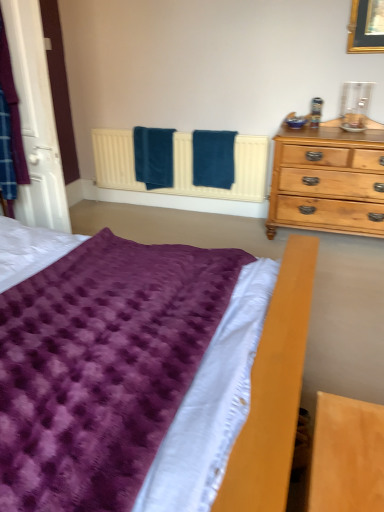
Question: Considering the relative positions of teal soft towel at center, the 2th bath towel positioned from the left, and purple fuzzy blanket at lower left in the image provided, is teal soft towel at center, the 2th bath towel positioned from the left, to the right of purple fuzzy blanket at lower left from the viewer's perspective?

Choices:
 (A) no
 (B) yes

Answer: (B)

Question: Is teal soft towel at center, the 1th bath towel from the right, wider than purple fuzzy blanket at lower left?

Choices:
 (A) yes
 (B) no

Answer: (B)

Question: Considering the relative sizes of teal soft towel at center, the 1th bath towel from the right, and purple fuzzy blanket at lower left in the image provided, is teal soft towel at center, the 1th bath towel from the right, taller than purple fuzzy blanket at lower left?

Choices:
 (A) yes
 (B) no

Answer: (B)

Question: Is teal soft towel at center, the 2th bath towel positioned from the left, outside of purple fuzzy blanket at lower left?

Choices:
 (A) yes
 (B) no

Answer: (A)

Question: Is teal soft towel at center, the 1th bath towel from the right, aimed at purple fuzzy blanket at lower left?

Choices:
 (A) yes
 (B) no

Answer: (A)

Question: Is purple fuzzy blanket at lower left at the back of teal soft towel at center, the 1th bath towel from the right?

Choices:
 (A) no
 (B) yes

Answer: (A)

Question: Is blue soft towel at center, which is the first bath towel from left to right, not within teal soft towel at center, the 2th bath towel positioned from the left?

Choices:
 (A) no
 (B) yes

Answer: (B)

Question: Is blue soft towel at center, marked as the second bath towel in a right-to-left arrangement, in contact with teal soft towel at center, the 2th bath towel positioned from the left?

Choices:
 (A) no
 (B) yes

Answer: (A)

Question: Is blue soft towel at center, which is the first bath towel from left to right, wider than teal soft towel at center, the 1th bath towel from the right?

Choices:
 (A) no
 (B) yes

Answer: (A)

Question: Is blue soft towel at center, marked as the second bath towel in a right-to-left arrangement, to the right of teal soft towel at center, the 2th bath towel positioned from the left, from the viewer's perspective?

Choices:
 (A) yes
 (B) no

Answer: (B)

Question: Is blue soft towel at center, which is the first bath towel from left to right, further to the viewer compared to teal soft towel at center, the 1th bath towel from the right?

Choices:
 (A) yes
 (B) no

Answer: (A)

Question: Considering the relative positions of blue soft towel at center, marked as the second bath towel in a right-to-left arrangement, and teal soft towel at center, the 1th bath towel from the right, in the image provided, is blue soft towel at center, marked as the second bath towel in a right-to-left arrangement, to the left of teal soft towel at center, the 1th bath towel from the right, from the viewer's perspective?

Choices:
 (A) no
 (B) yes

Answer: (B)

Question: Is teal soft towel at center, the 2th bath towel positioned from the left, positioned with its back to blue soft towel at center, marked as the second bath towel in a right-to-left arrangement?

Choices:
 (A) yes
 (B) no

Answer: (B)